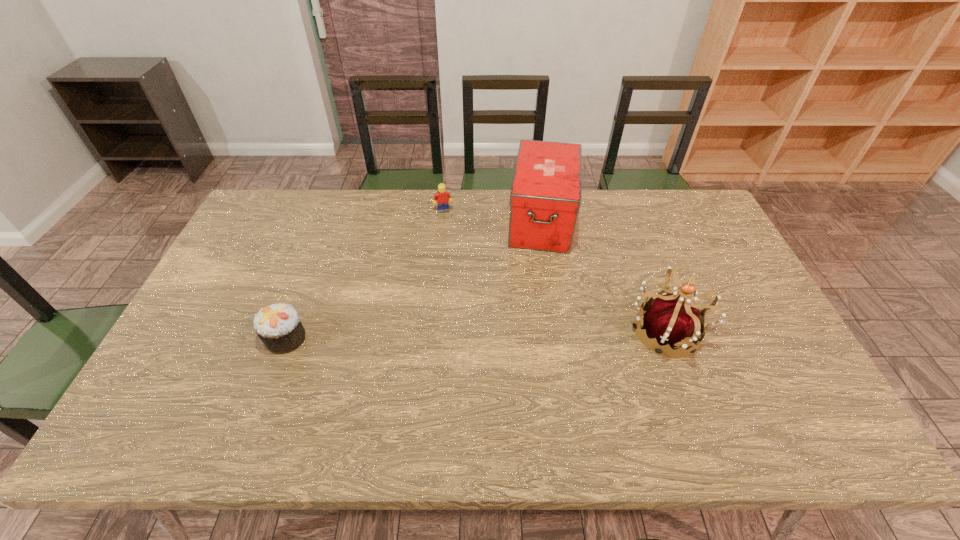
Locate an element on the screen. the leftmost object is located at coordinates (278, 326).

Locate an element on the screen. This screenshot has width=960, height=540. tiara is located at coordinates (670, 319).

Identify the location of the third object from right to left. This screenshot has height=540, width=960. (441, 196).

Locate an element on the screen. This screenshot has height=540, width=960. the second object from right to left is located at coordinates (545, 197).

This screenshot has width=960, height=540. I want to click on free space located 0.350m on the right of the leftmost object, so click(x=438, y=338).

Locate an element on the screen. The height and width of the screenshot is (540, 960). free spot located on the front-facing side of the tiara is located at coordinates (758, 332).

Identify the location of vacant area situated 0.070m on the front-facing side of the Lego. [449, 226].

Locate an element on the screen. vacant space positioned 0.270m on the front-facing side of the Lego is located at coordinates (461, 266).

Identify the location of free location located on the front-facing side of the Lego. This screenshot has width=960, height=540. (467, 287).

Image resolution: width=960 pixels, height=540 pixels. In order to click on free space located 0.290m on the handle side of the second object from right to left in this screenshot , I will do `click(534, 326)`.